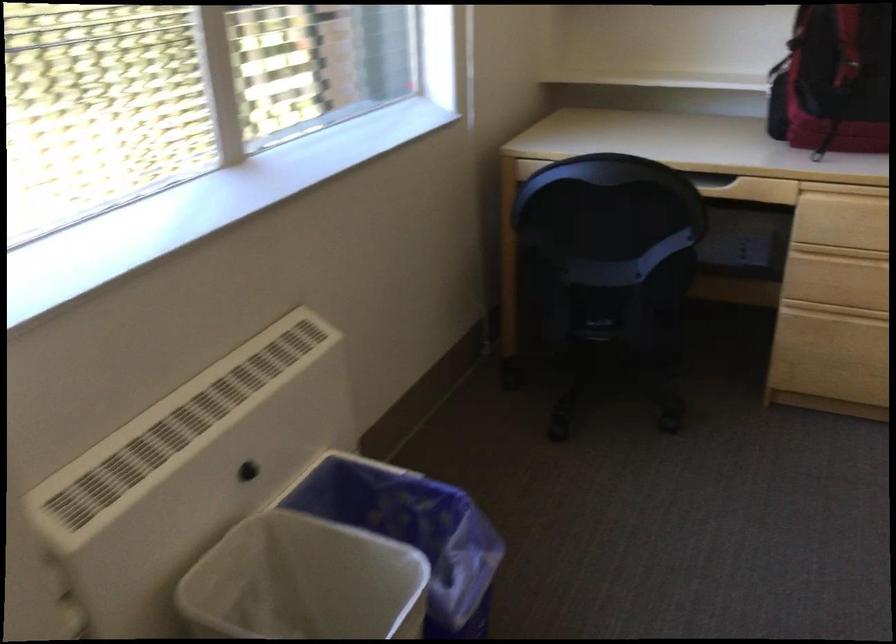
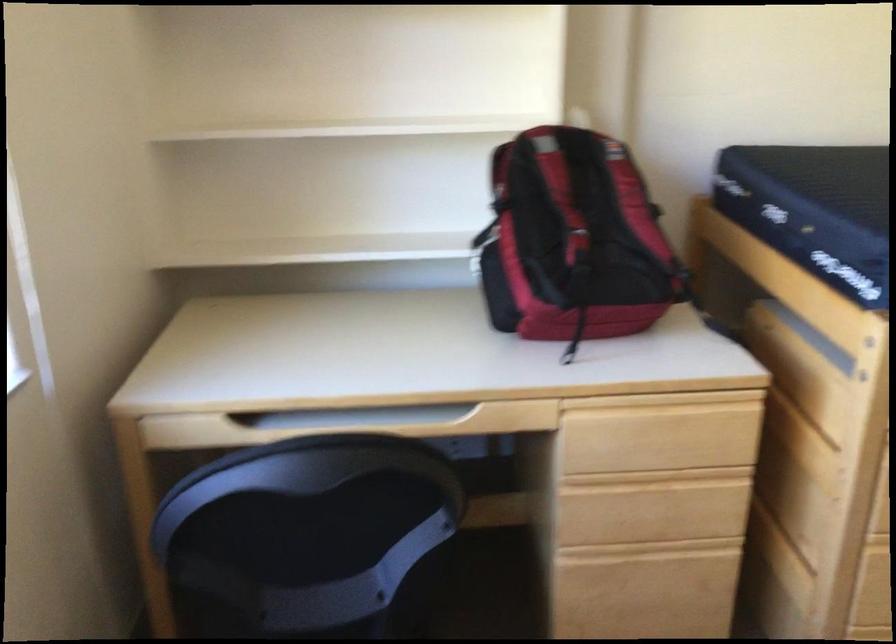
Question: In a continuous first-person perspective shot, in which direction is the camera moving?

Choices:
 (A) Left
 (B) Right
 (C) Forward
 (D) Backward

Answer: (C)